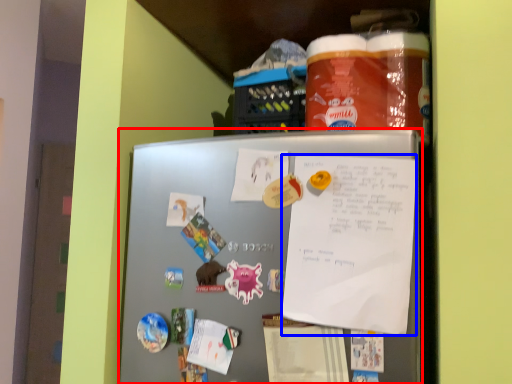
Question: Among these objects, which one is nearest to the camera, refrigerator (highlighted by a red box) or poster (highlighted by a blue box)?

Choices:
 (A) refrigerator
 (B) poster

Answer: (A)